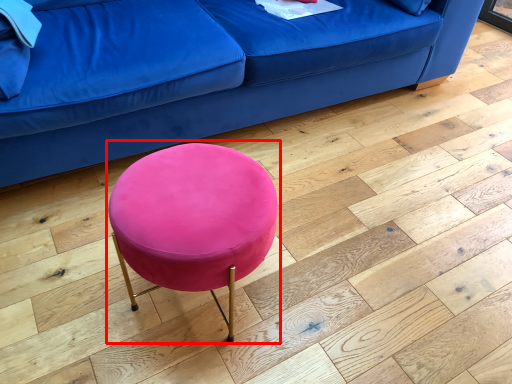
Question: Where is bar stool (annotated by the red box) located in relation to studio couch in the image?

Choices:
 (A) left
 (B) right

Answer: (A)